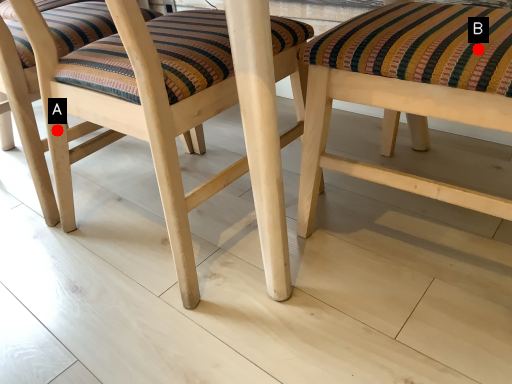
Question: Two points are circled on the image, labeled by A and B beside each circle. Among these points, which one is nearest to the camera?

Choices:
 (A) A is closer
 (B) B is closer

Answer: (B)